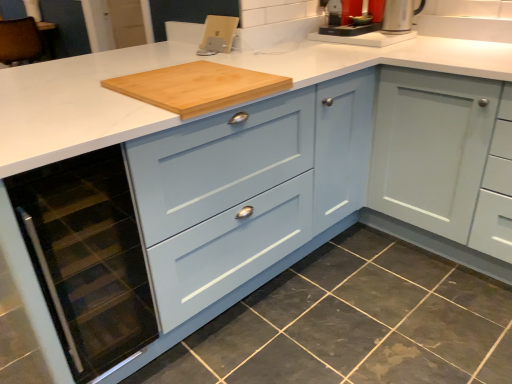
Question: In terms of width, does light blue wood cabinet at center look wider or thinner when compared to dark gray granite at lower left?

Choices:
 (A) thin
 (B) wide

Answer: (B)

Question: Which is correct: light blue wood cabinet at center is inside dark gray granite at lower left, or outside of it?

Choices:
 (A) inside
 (B) outside

Answer: (B)

Question: Which of these objects is positioned farthest from the silver metallic kettle at upper right?

Choices:
 (A) light blue wood cabinet at center
 (B) matte glass oven at lower left
 (C) silver metallic coffee machine at upper center
 (D) dark gray granite at lower left
 (E) natural wood cutting board at center

Answer: (B)

Question: Which object is the closest to the matte glass oven at lower left?

Choices:
 (A) silver metallic kettle at upper right
 (B) dark gray granite at lower left
 (C) silver metallic coffee machine at upper center
 (D) light blue wood cabinet at center
 (E) natural wood cutting board at center

Answer: (D)